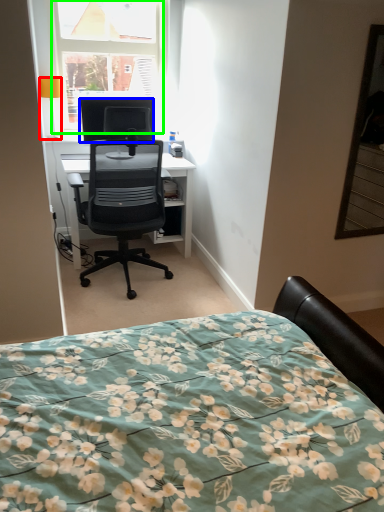
Question: Which object is positioned farthest from lamp (highlighted by a red box)? Select from television (highlighted by a blue box) and window (highlighted by a green box).

Choices:
 (A) television
 (B) window

Answer: (B)